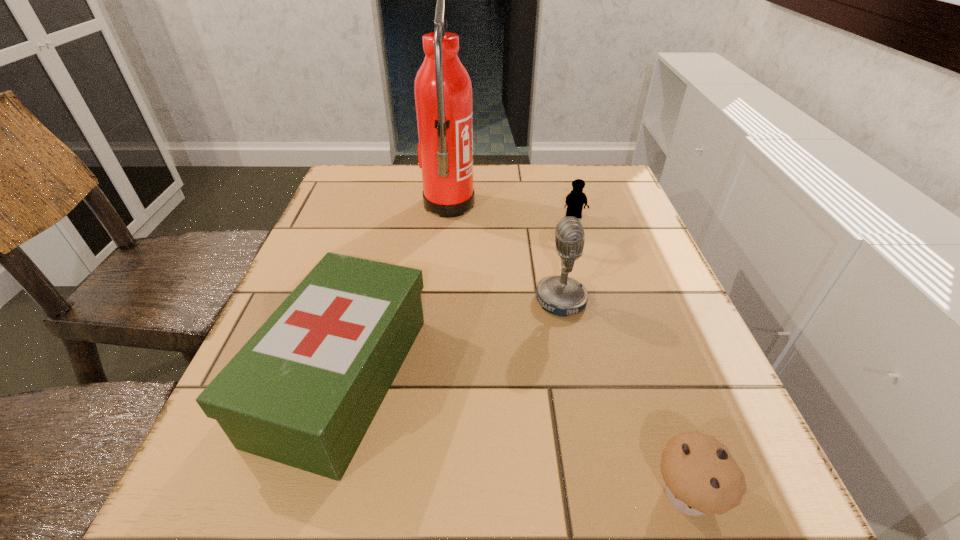
Find the location of a particular element. fire extinguisher is located at coordinates (443, 91).

I want to click on microphone, so click(561, 295).

Find the location of a particular element. The image size is (960, 540). the first-aid kit is located at coordinates (304, 389).

Where is `Lego`? Image resolution: width=960 pixels, height=540 pixels. Lego is located at coordinates (575, 200).

In order to click on muffin in this screenshot , I will do `click(700, 476)`.

At what (x,y) coordinates should I click in order to perform the action: click on vacant region located 0.100m on the label side of the fire extinguisher. Please return your answer as a coordinate pair (x, y). The image size is (960, 540). Looking at the image, I should click on (515, 205).

The height and width of the screenshot is (540, 960). I want to click on free space located 0.370m on the front-facing side of the second tallest object, so click(x=343, y=300).

Locate an element on the screen. The width and height of the screenshot is (960, 540). vacant area situated on the front-facing side of the second tallest object is located at coordinates (369, 300).

The height and width of the screenshot is (540, 960). I want to click on vacant area situated on the front-facing side of the second tallest object, so click(384, 300).

Find the location of a particular element. The image size is (960, 540). blank space located on the front of the third shortest object is located at coordinates (297, 536).